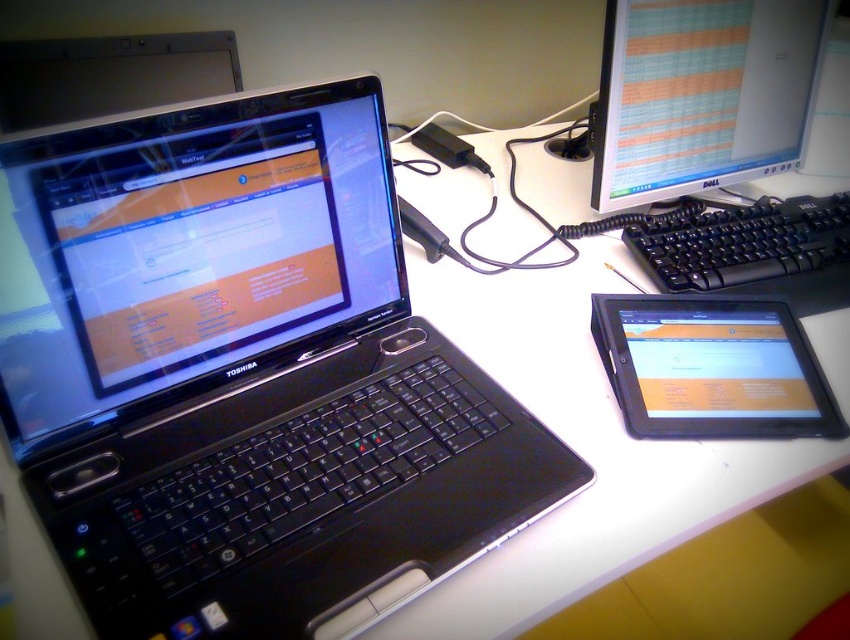
Question: Is black plastic laptop at left to the right of black plastic keyboard at right from the viewer's perspective?

Choices:
 (A) yes
 (B) no

Answer: (B)

Question: Which of these objects is positioned closest to the black plastic keyboard at right?

Choices:
 (A) matte plastic monitor at upper right
 (B) black plastic laptop at left
 (C) black matte tablet at lower right

Answer: (A)

Question: Can you confirm if black plastic laptop at left is positioned above black matte tablet at lower right?

Choices:
 (A) yes
 (B) no

Answer: (A)

Question: Which point is farther to the camera?

Choices:
 (A) pos(741,280)
 (B) pos(700,4)

Answer: (B)

Question: Does black plastic laptop at left lie in front of black plastic keyboard at right?

Choices:
 (A) no
 (B) yes

Answer: (B)

Question: Which of these objects is positioned farthest from the black matte tablet at lower right?

Choices:
 (A) matte plastic monitor at upper right
 (B) black plastic keyboard at right
 (C) black plastic laptop at left

Answer: (A)